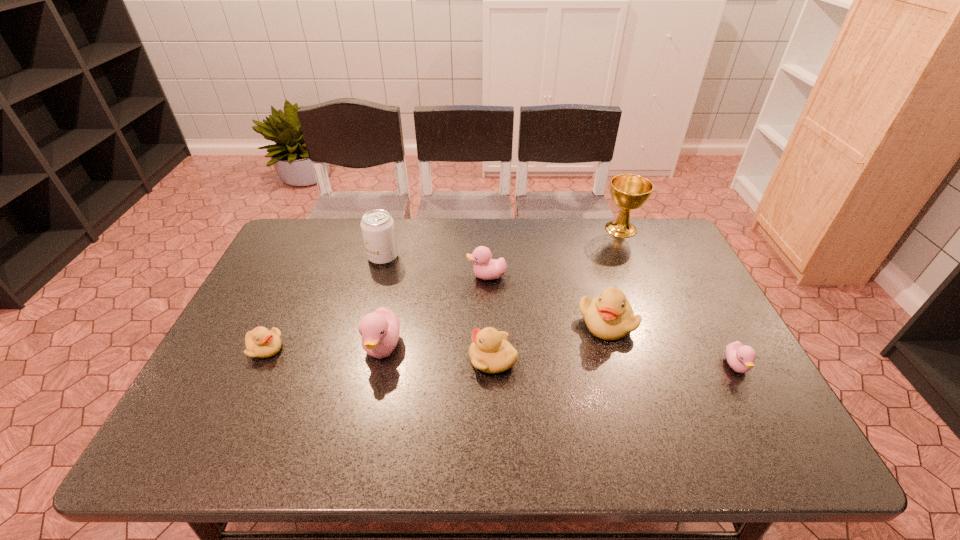
Locate an element on the screen. This screenshot has width=960, height=540. the farthest object is located at coordinates (629, 192).

You are a GUI agent. You are given a task and a screenshot of the screen. Output one action in this format:
    pyautogui.click(x=<x>, y=<y>)
    Task: Click on the chalice
    Image resolution: width=960 pixels, height=540 pixels.
    Given the screenshot: What is the action you would take?
    pyautogui.click(x=629, y=192)

Locate an element on the screen. This screenshot has width=960, height=540. soda can is located at coordinates (377, 226).

This screenshot has height=540, width=960. I want to click on the biggest pink duckling, so (x=380, y=330).

Where is `the leftmost pink duckling`? The image size is (960, 540). the leftmost pink duckling is located at coordinates (380, 330).

Locate an element on the screen. Image resolution: width=960 pixels, height=540 pixels. the sixth object from left to right is located at coordinates (609, 316).

At what (x,y) coordinates should I click in order to perform the action: click on the biggest yellow duckling. Please return your answer as a coordinate pair (x, y). Looking at the image, I should click on (609, 316).

In order to click on the farthest duckling in this screenshot , I will do `click(485, 268)`.

Locate an element on the screen. This screenshot has height=540, width=960. the sixth nearest object is located at coordinates (485, 268).

You are a GUI agent. You are given a task and a screenshot of the screen. Output one action in this format:
    pyautogui.click(x=<x>, y=<y>)
    Task: Click on the second smallest yellow duckling
    
    Given the screenshot: What is the action you would take?
    pyautogui.click(x=490, y=352)